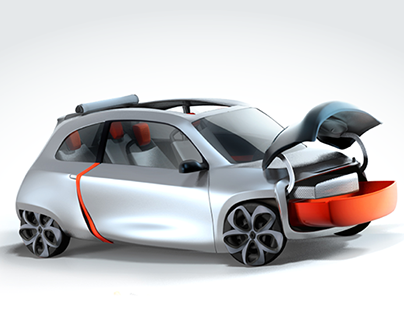
I want to click on seats, so click(186, 149), click(157, 156), click(119, 148), click(83, 152).